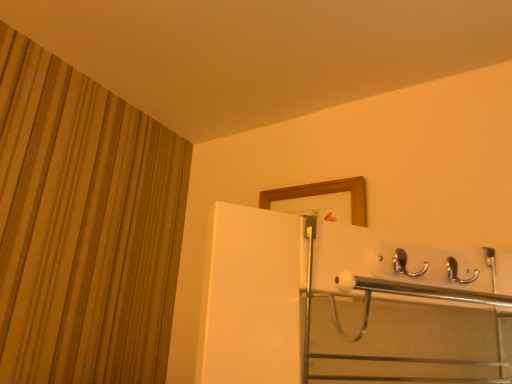
Where is `satin silver oven at upper center`? The height and width of the screenshot is (384, 512). satin silver oven at upper center is located at coordinates (344, 306).

What do you see at coordinates (344, 306) in the screenshot?
I see `satin silver oven at upper center` at bounding box center [344, 306].

What is the approximate height of satin silver oven at upper center?

It is 9.36 inches.

The width and height of the screenshot is (512, 384). Identify the location of satin silver oven at upper center. (344, 306).